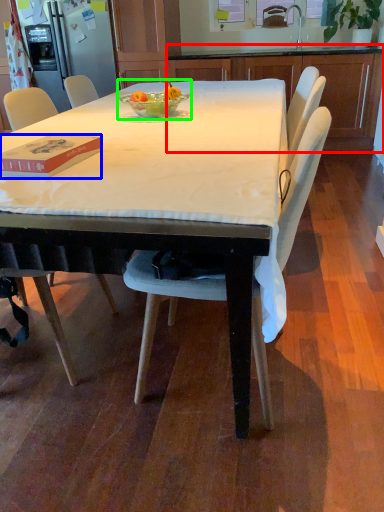
Question: Considering the real-world distances, which object is farthest from cabinetry (highlighted by a red box)? box (highlighted by a blue box) or fruit dish (highlighted by a green box)?

Choices:
 (A) box
 (B) fruit dish

Answer: (A)